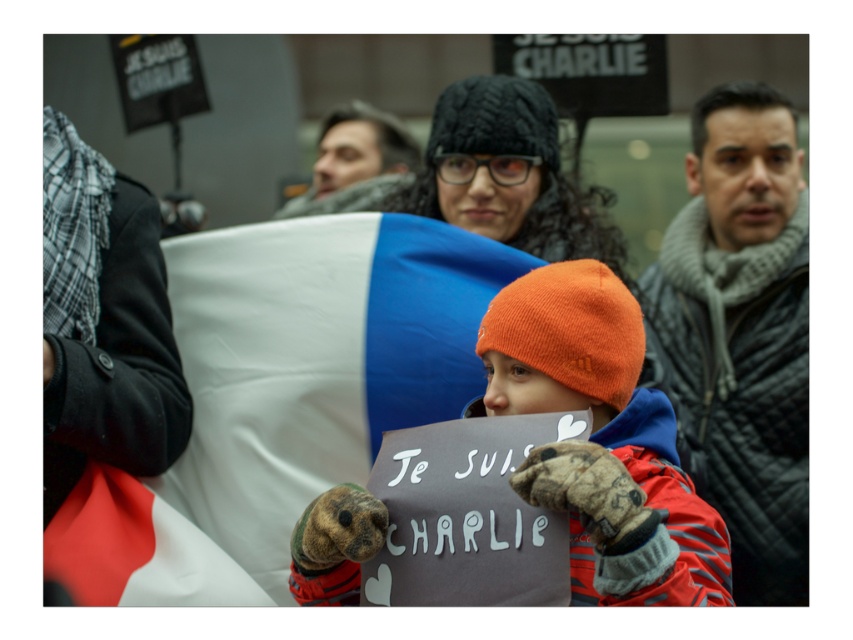
Is point (368, 397) closer to viewer compared to point (741, 396)?

Yes, point (368, 397) is in front of point (741, 396).

Who is shorter, white fabric flag at center or gray quilted jacket at right?

white fabric flag at center is shorter.

This screenshot has width=853, height=640. What do you see at coordinates (281, 397) in the screenshot? I see `white fabric flag at center` at bounding box center [281, 397].

This screenshot has height=640, width=853. Find the location of `white fabric flag at center`. white fabric flag at center is located at coordinates (281, 397).

Does white fabric flag at center have a greater width compared to orange knit beanie at center?

Indeed, white fabric flag at center has a greater width compared to orange knit beanie at center.

What do you see at coordinates (281, 397) in the screenshot? This screenshot has height=640, width=853. I see `white fabric flag at center` at bounding box center [281, 397].

Who is more distant from viewer, (503, 280) or (639, 413)?

The point (503, 280) is more distant.

In order to click on white fabric flag at center in this screenshot , I will do point(281,397).

Does gray quilted jacket at right have a greater width compared to orange knit beanie at center?

Correct, the width of gray quilted jacket at right exceeds that of orange knit beanie at center.

Between gray quilted jacket at right and orange knit beanie at center, which one appears on the left side from the viewer's perspective?

From the viewer's perspective, orange knit beanie at center appears more on the left side.

Where is `gray quilted jacket at right`? Image resolution: width=853 pixels, height=640 pixels. gray quilted jacket at right is located at coordinates (743, 330).